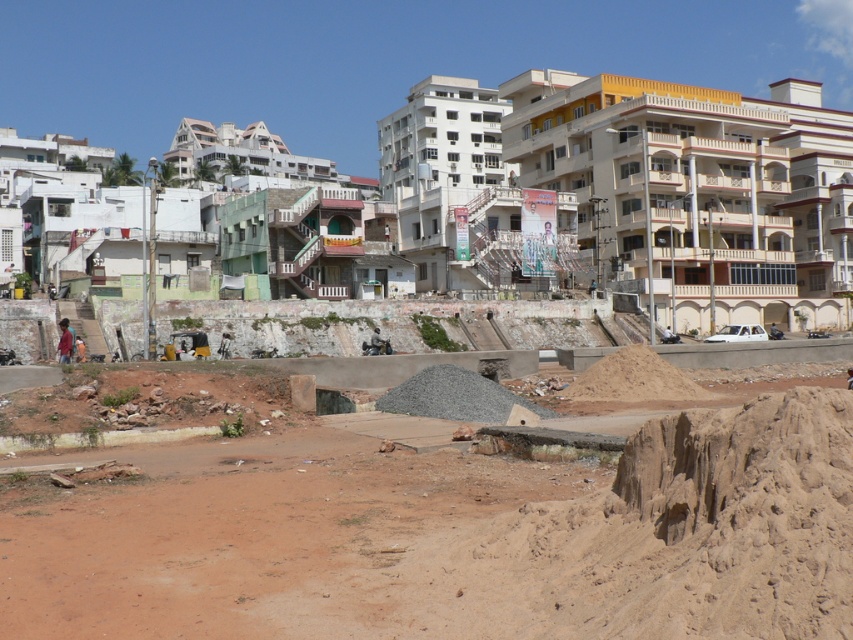
You are a delivery drone flying above an urban area. You need to land on the brown sandy dirt field at lower center and then proceed to the gray gravel pile at center. Which location should you land on first according to their positions?

The brown sandy dirt field at lower center is closer to the viewer than the gray gravel pile at center, so you should land on the brown sandy dirt field at lower center first before moving to the gray gravel pile at center.

In the scene shown: You are a city planner assessing the construction site. You need to determine which area has more space available for temporary storage between the gray gravel pile at center and the brown sandy mound at center. Which one would you choose?

The brown sandy mound at center occupies more space than the gray gravel pile at center, so it would be the better choice for temporary storage.